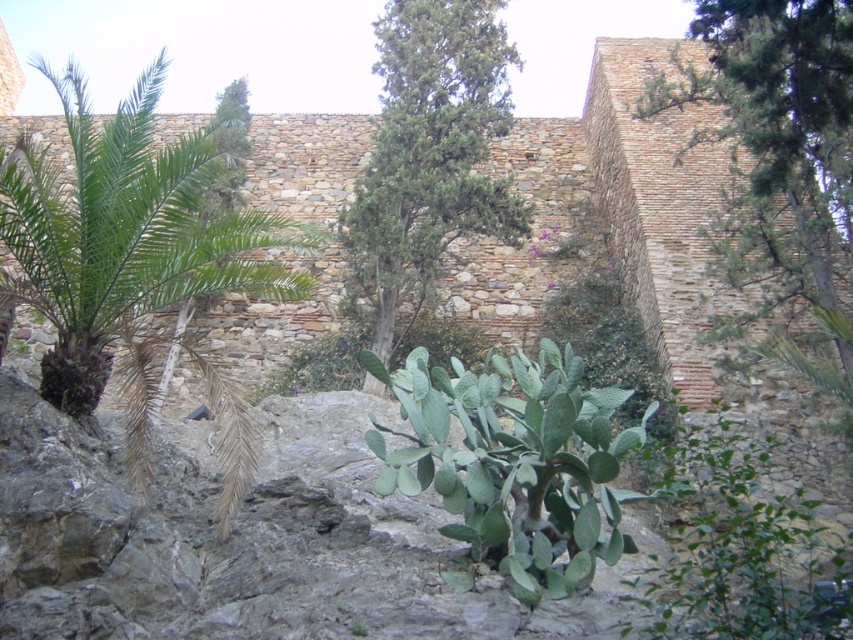
Question: Which object is farther from the camera taking this photo?

Choices:
 (A) green leafy tree at upper right
 (B) green leafy palm at left
 (C) green leafy tree at center

Answer: (C)

Question: Does green leafy tree at upper right have a greater width compared to green leafy tree at center?

Choices:
 (A) no
 (B) yes

Answer: (A)

Question: Does green leafy palm at left appear on the left side of green leafy tree at center?

Choices:
 (A) no
 (B) yes

Answer: (B)

Question: Which of these objects is positioned farthest from the green leafy palm at left?

Choices:
 (A) green leafy tree at center
 (B) green leafy tree at upper right

Answer: (B)

Question: Which of the following is the farthest from the observer?

Choices:
 (A) (498, 188)
 (B) (764, 195)

Answer: (A)

Question: Can you confirm if green leafy tree at upper right is bigger than green leafy tree at center?

Choices:
 (A) no
 (B) yes

Answer: (A)